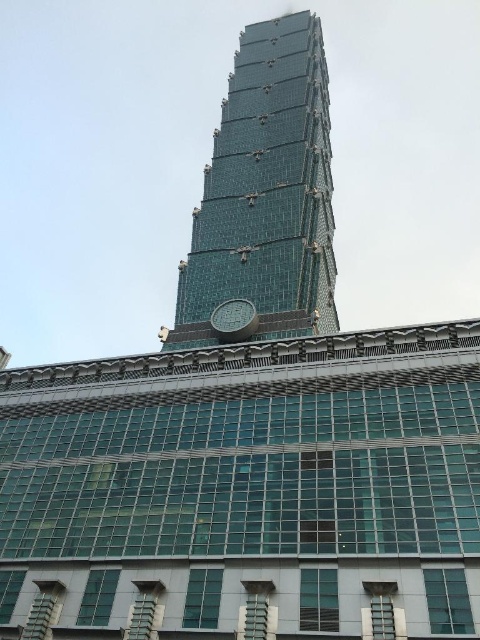
You are standing in front of the architectural structure and want to take a photo that includes both the transparent glass tower at center and the metallic clock at center. Which object will appear larger in your photo?

The transparent glass tower at center will appear larger in the photo because it is closer to the viewer than the metallic clock at center.

You are an architect planning to install a new lighting system. You need to determine which object, the transparent glass tower at center or the metallic clock at center, requires more lights due to its size. Which one would need more lights?

The transparent glass tower at center requires more lights because it has a larger size compared to the metallic clock at center.